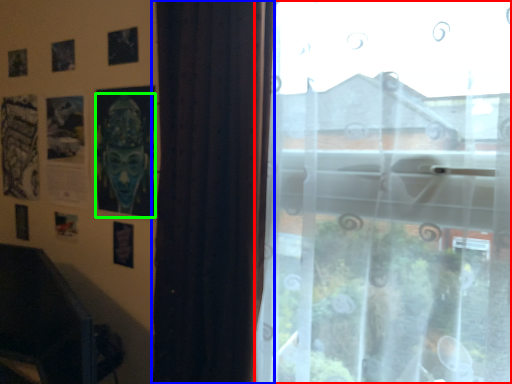
Question: Which object is the farthest from window (highlighted by a red box)? Choose among these: curtain (highlighted by a blue box) or person (highlighted by a green box).

Choices:
 (A) curtain
 (B) person

Answer: (B)